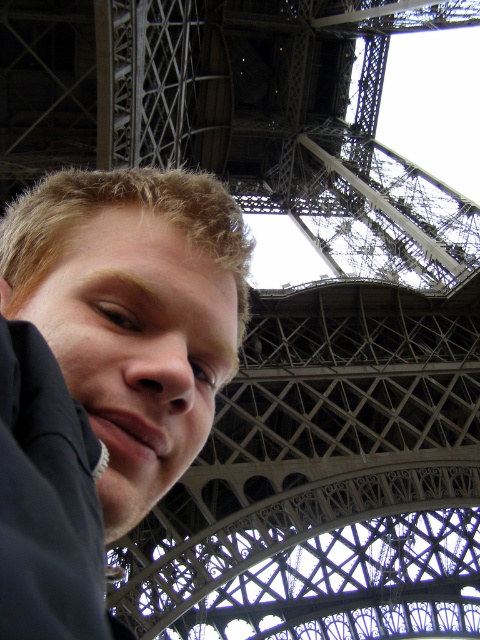
Is point (79, 506) farther from camera compared to point (228, 131)?

No, (79, 506) is in front of (228, 131).

Can you confirm if matte black hair at lower left is thinner than metallic gray lattice structure at center?

Yes, matte black hair at lower left is thinner than metallic gray lattice structure at center.

Who is more distant from viewer, [93,484] or [192,134]?

The point [192,134] is more distant.

At what (x,y) coordinates should I click in order to perform the action: click on matte black hair at lower left. Please return your answer as a coordinate pair (x, y). Looking at the image, I should click on (105, 372).